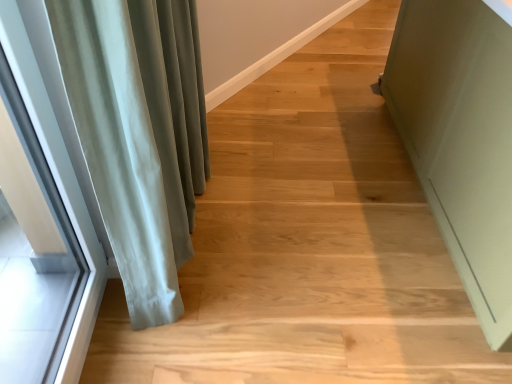
Question: Considering the relative sizes of satin green curtain at left and matte green cabinet at right in the image provided, is satin green curtain at left bigger than matte green cabinet at right?

Choices:
 (A) no
 (B) yes

Answer: (A)

Question: Is satin green curtain at left touching matte green cabinet at right?

Choices:
 (A) yes
 (B) no

Answer: (B)

Question: Could you tell me if satin green curtain at left is facing matte green cabinet at right?

Choices:
 (A) no
 (B) yes

Answer: (B)

Question: Is satin green curtain at left at the left side of matte green cabinet at right?

Choices:
 (A) yes
 (B) no

Answer: (A)

Question: Is satin green curtain at left oriented away from matte green cabinet at right?

Choices:
 (A) yes
 (B) no

Answer: (B)

Question: From a real-world perspective, is satin green curtain at left beneath matte green cabinet at right?

Choices:
 (A) no
 (B) yes

Answer: (A)

Question: Considering the relative sizes of clear glass window at left and satin green curtain at left in the image provided, is clear glass window at left bigger than satin green curtain at left?

Choices:
 (A) no
 (B) yes

Answer: (A)

Question: From a real-world perspective, is clear glass window at left beneath satin green curtain at left?

Choices:
 (A) yes
 (B) no

Answer: (B)

Question: Considering the relative positions of clear glass window at left and satin green curtain at left in the image provided, is clear glass window at left to the left of satin green curtain at left from the viewer's perspective?

Choices:
 (A) no
 (B) yes

Answer: (B)

Question: From the image's perspective, is clear glass window at left under satin green curtain at left?

Choices:
 (A) yes
 (B) no

Answer: (A)

Question: Is clear glass window at left shorter than satin green curtain at left?

Choices:
 (A) yes
 (B) no

Answer: (B)

Question: Considering the relative sizes of clear glass window at left and satin green curtain at left in the image provided, is clear glass window at left wider than satin green curtain at left?

Choices:
 (A) no
 (B) yes

Answer: (A)

Question: Can you confirm if satin green curtain at left is wider than clear glass window at left?

Choices:
 (A) no
 (B) yes

Answer: (B)